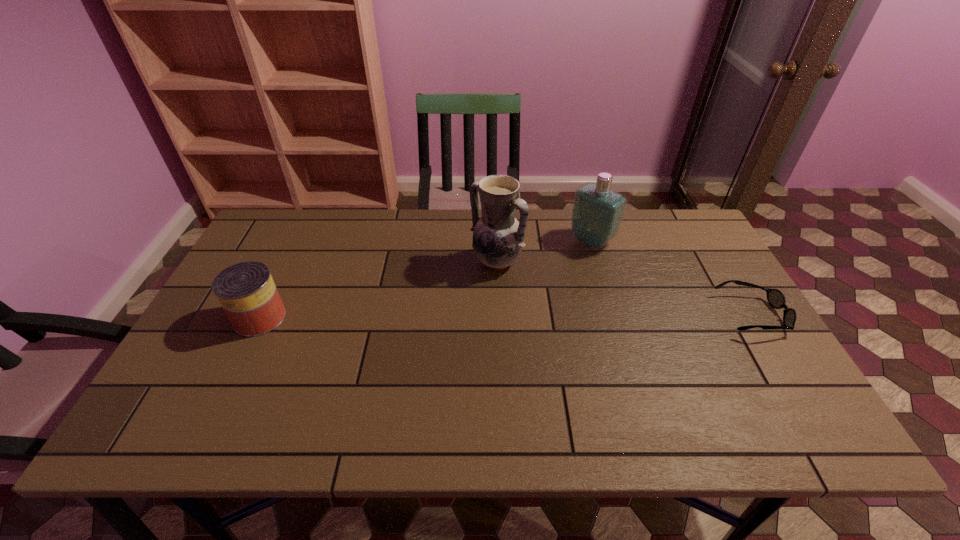
I want to click on free space at the right edge of the desktop, so tap(752, 343).

This screenshot has width=960, height=540. I want to click on vacant region at the far left corner, so (312, 211).

The image size is (960, 540). In the image, there is a desktop. In order to click on vacant space at the far right corner in this screenshot , I will do `click(695, 234)`.

Locate an element on the screen. The image size is (960, 540). free point between the pottery and the sunglasses is located at coordinates (624, 288).

I want to click on empty space between the leftmost object and the sunglasses, so click(506, 316).

You are a GUI agent. You are given a task and a screenshot of the screen. Output one action in this format:
    pyautogui.click(x=<x>, y=<y>)
    Task: Click on the unoccupied position between the third shortest object and the third object from right to left
    
    Given the screenshot: What is the action you would take?
    pyautogui.click(x=544, y=251)

Where is `free area in between the rightmost object and the third object from right to left`? The image size is (960, 540). free area in between the rightmost object and the third object from right to left is located at coordinates pos(624,288).

You are a GUI agent. You are given a task and a screenshot of the screen. Output one action in this format:
    pyautogui.click(x=<x>, y=<y>)
    Task: Click on the free space between the shortest object and the leftmost object
    
    Given the screenshot: What is the action you would take?
    pyautogui.click(x=506, y=316)

Locate an element on the screen. vacant area that lies between the can and the rightmost object is located at coordinates (506, 316).

Where is `free point between the shortest object and the pottery`? The width and height of the screenshot is (960, 540). free point between the shortest object and the pottery is located at coordinates (624, 288).